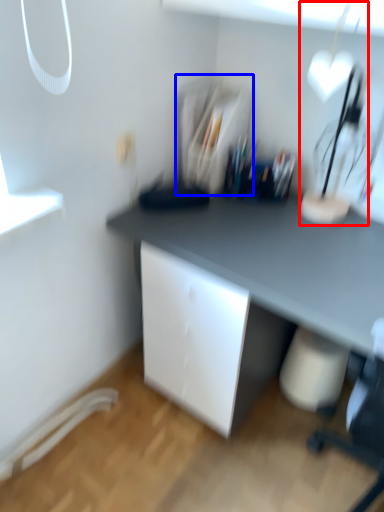
Question: Which object is closer to the camera taking this photo, table lamp (highlighted by a red box) or shelf (highlighted by a blue box)?

Choices:
 (A) table lamp
 (B) shelf

Answer: (A)